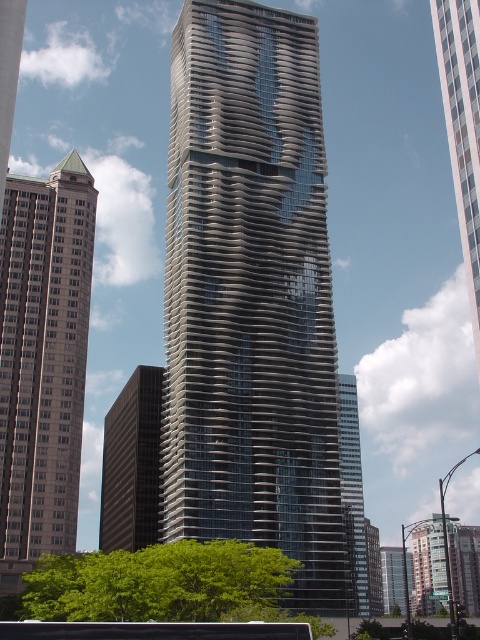
Question: Is black rubber tour bus at lower center smaller than glassy steel skyscraper at right?

Choices:
 (A) no
 (B) yes

Answer: (B)

Question: Does beige stone building at left appear on the right side of black rubber tour bus at lower center?

Choices:
 (A) no
 (B) yes

Answer: (A)

Question: Estimate the real-world distances between objects in this image. Which object is closer to the brown glass building at center?

Choices:
 (A) beige stone building at left
 (B) black rubber tour bus at lower center
 (C) glassy steel skyscraper at right

Answer: (C)

Question: Does gray concrete skyscraper at center have a lesser width compared to beige stone building at left?

Choices:
 (A) no
 (B) yes

Answer: (A)

Question: Which point appears farthest from the camera in this image?

Choices:
 (A) (108, 515)
 (B) (467, 278)
 (C) (3, 632)
 (D) (343, 522)

Answer: (A)

Question: Estimate the real-world distances between objects in this image. Which object is closer to the black rubber tour bus at lower center?

Choices:
 (A) brown glass building at center
 (B) beige stone building at left
 (C) glassy reflective skyscraper at right
 (D) gray concrete skyscraper at center

Answer: (C)